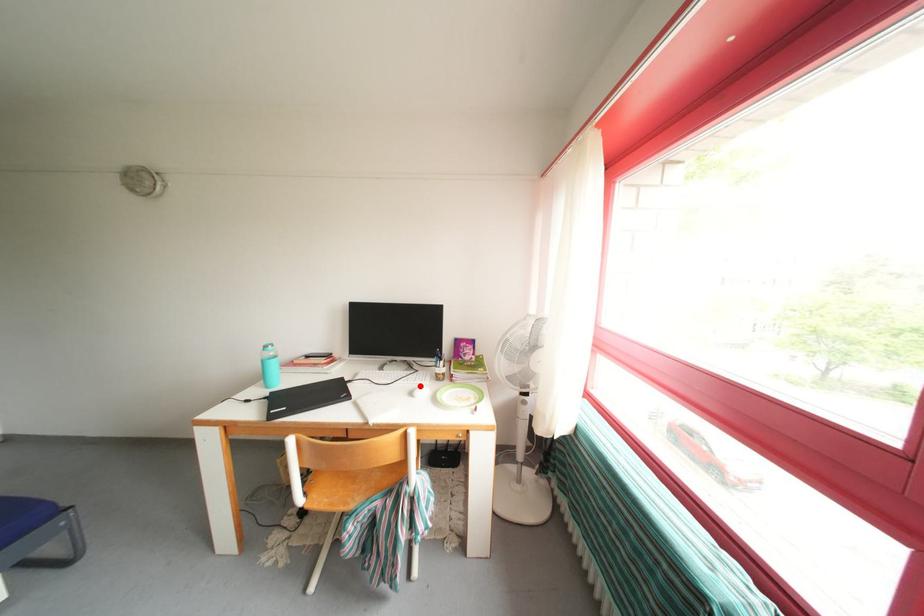
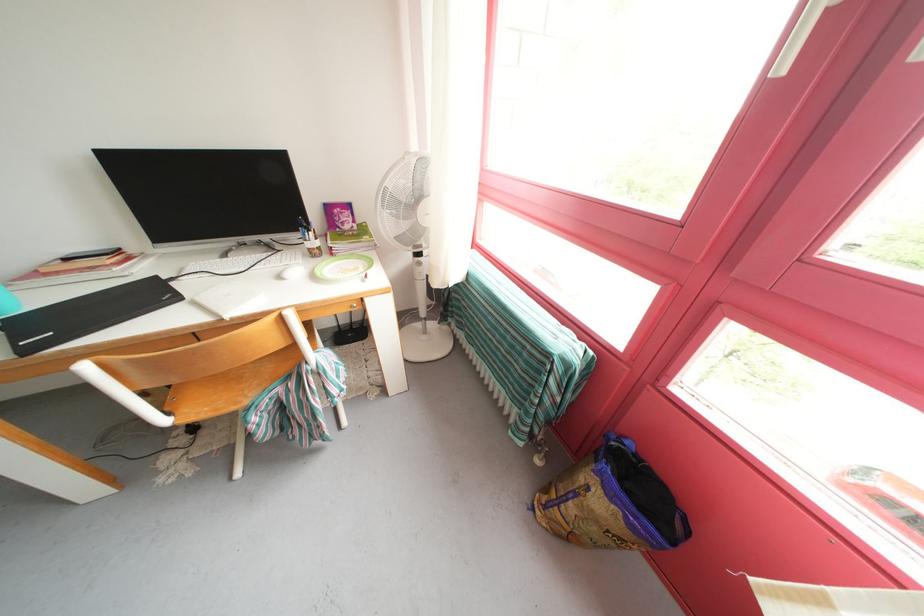
Where in the second image is the point corresponding to the highlighted location from the first image?

(284, 267)